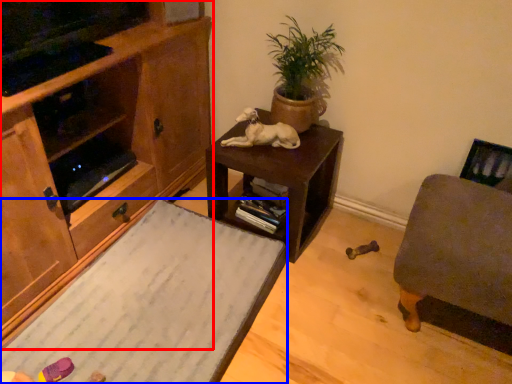
Question: Among these objects, which one is nearest to the camera, cabinetry (highlighted by a red box) or desk (highlighted by a blue box)?

Choices:
 (A) cabinetry
 (B) desk

Answer: (A)